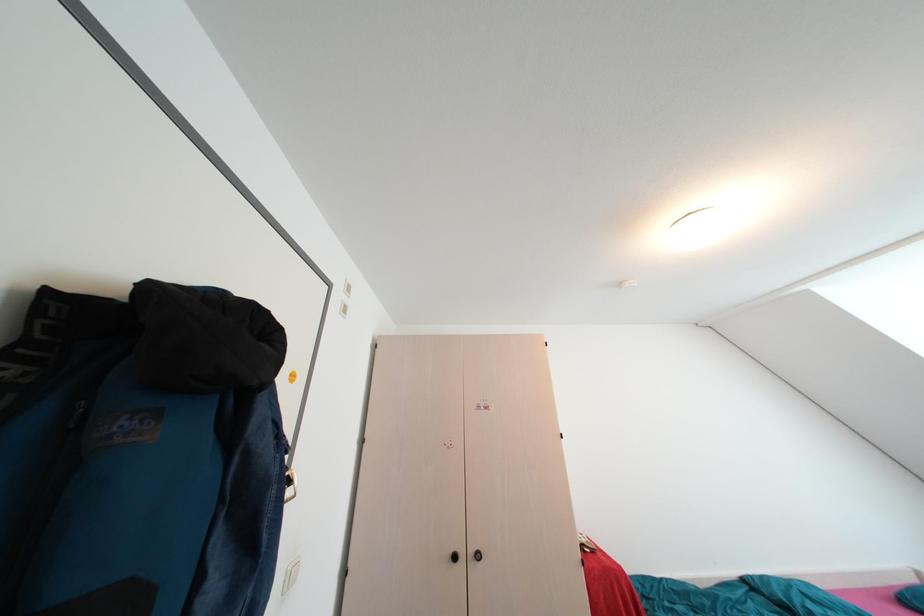
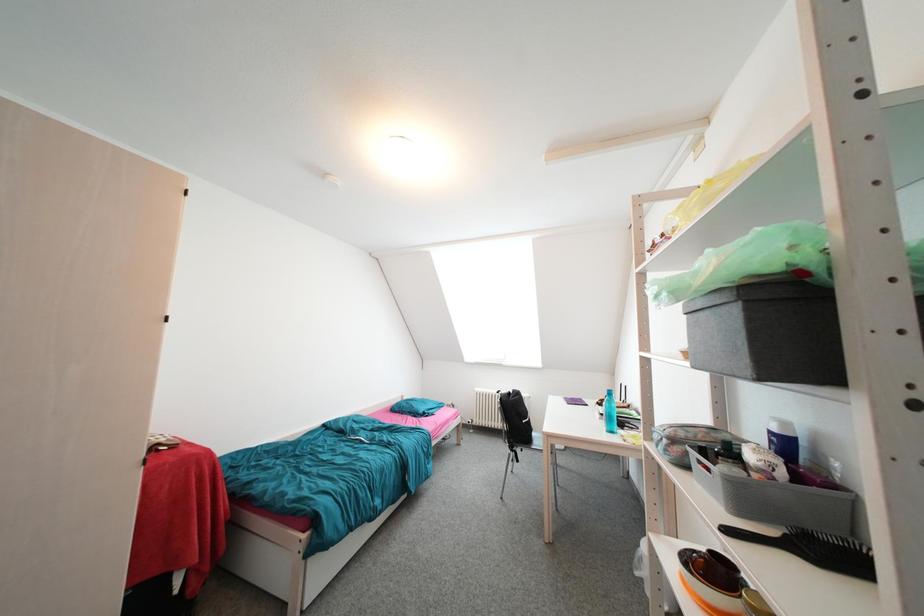
Question: The camera is either moving clockwise (left) or counter-clockwise (right) around the object. The first image is from the beginning of the video and the second image is from the end. Is the camera moving left or right when shooting the video?

Choices:
 (A) Left
 (B) Right

Answer: (A)